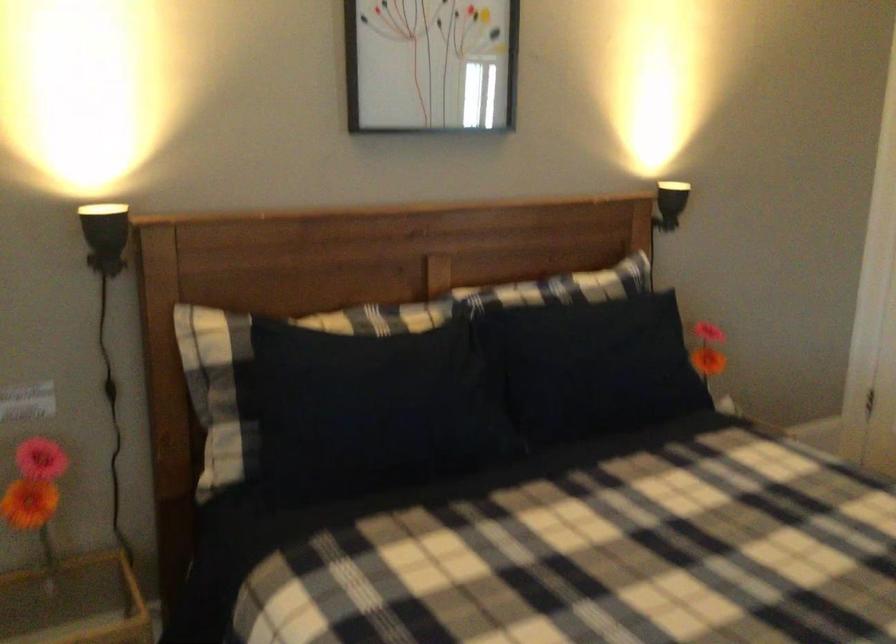
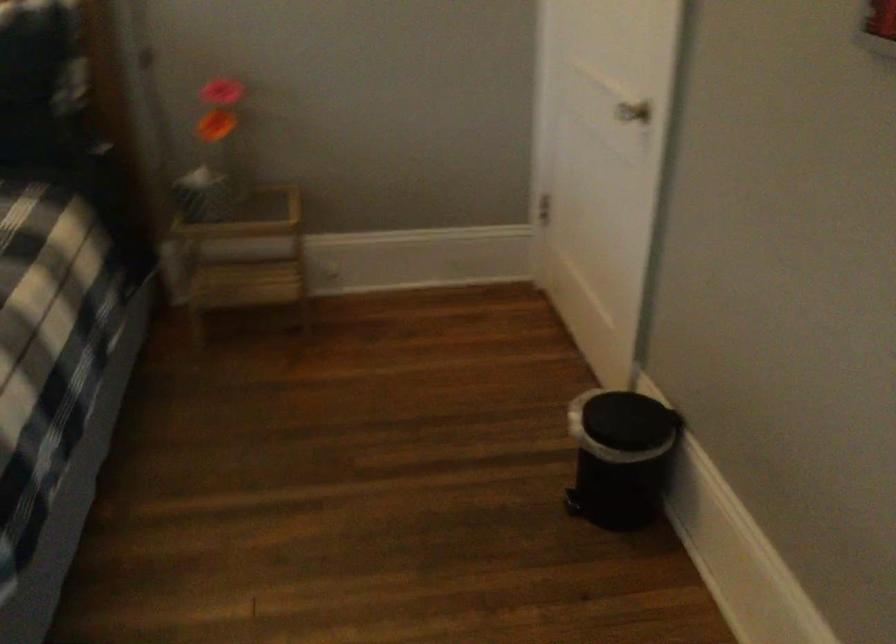
Question: In a continuous first-person perspective shot, in which direction is the camera moving?

Choices:
 (A) Left
 (B) Right
 (C) Forward
 (D) Backward

Answer: (B)